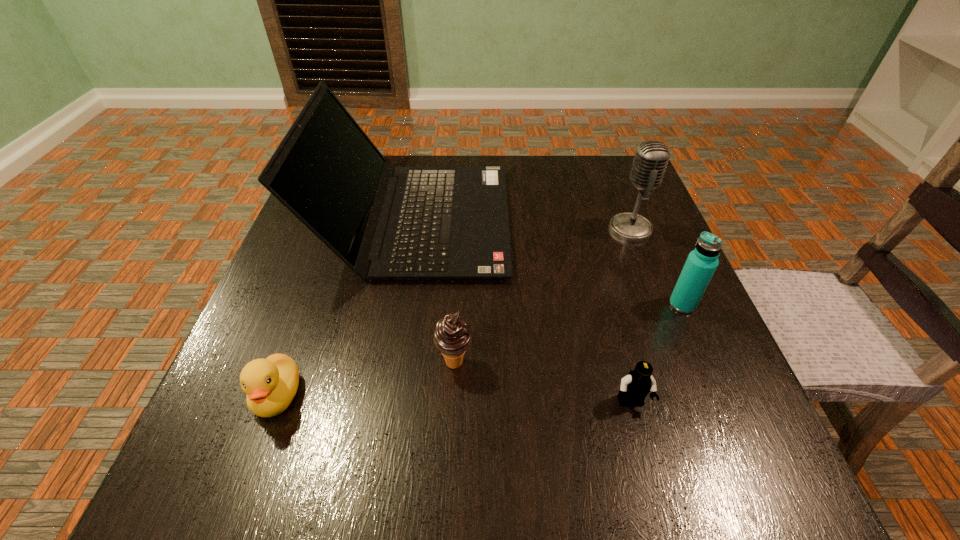
Locate an element on the screen. free spot that satisfies the following two spatial constraints: 1. on the screen of the laptop computer; 2. on the face of the duckling is located at coordinates (387, 396).

The height and width of the screenshot is (540, 960). Identify the location of blank space that satisfies the following two spatial constraints: 1. on the screen of the microphone; 2. on the left side of the laptop computer. (415, 228).